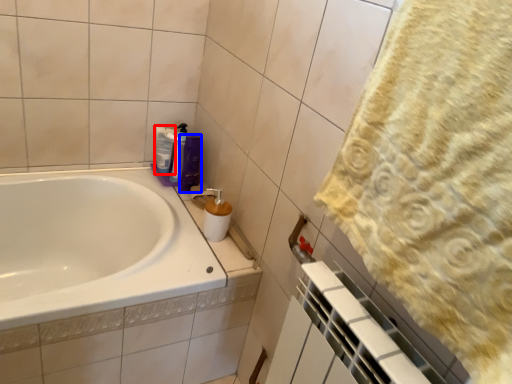
Question: Which point is closer to the camera, cleaning product (highlighted by a red box) or toiletry (highlighted by a blue box)?

Choices:
 (A) cleaning product
 (B) toiletry

Answer: (B)